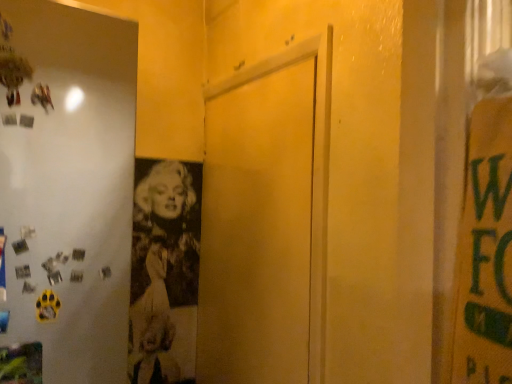
Question: Should I look upward or downward to see white glossy refrigerator at left?

Choices:
 (A) down
 (B) up

Answer: (A)